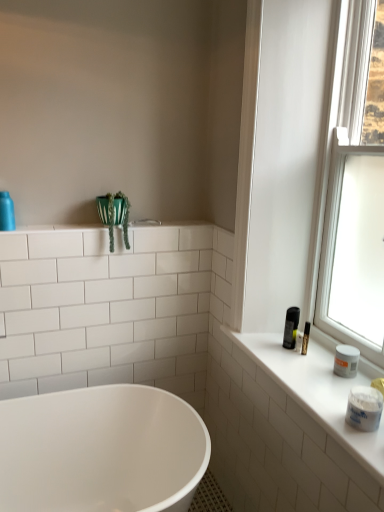
In order to face matte blue bottle at upper left, which appears as the 1th toiletry when viewed from the back, should I rotate leftwards or rightwards?

To face it directly, rotate left by 23.615 degrees.

What is the approximate width of matte blue bottle at upper left, which is counted as the second toiletry, starting from the right?

matte blue bottle at upper left, which is counted as the second toiletry, starting from the right, is 2.74 inches wide.

What is the approximate height of white glossy shelf at upper left?

white glossy shelf at upper left is 0.88 inches in height.

The height and width of the screenshot is (512, 384). Describe the element at coordinates (59, 227) in the screenshot. I see `white glossy shelf at upper left` at that location.

What are the coordinates of `transparent glass window at upper right` in the screenshot? It's located at 342,162.

Is white matte jar at right, the 2th toiletry positioned from the left, at the left side of white glossy bathtub at lower center?

No, white matte jar at right, the 2th toiletry positioned from the left, is not to the left of white glossy bathtub at lower center.

Between white matte jar at right, the 2th toiletry positioned from the left, and white glossy bathtub at lower center, which one has larger width?

Wider between the two is white glossy bathtub at lower center.

In terms of size, does white matte jar at right, which ranks as the second toiletry in top-to-bottom order, appear bigger or smaller than white glossy bathtub at lower center?

In the image, white matte jar at right, which ranks as the second toiletry in top-to-bottom order, appears to be smaller than white glossy bathtub at lower center.

Locate an element on the screen. This screenshot has height=512, width=384. the 1st toiletry above the white glossy bathtub at lower center (from the image's perspective) is located at coordinates (364, 408).

Is white glossy shelf at upper left looking in the opposite direction of matte blue bottle at upper left, the first toiletry viewed from the top?

No.

Are white glossy shelf at upper left and matte blue bottle at upper left, the 2th toiletry from the front, making contact?

No, white glossy shelf at upper left is not next to matte blue bottle at upper left, the 2th toiletry from the front.

Consider the image. Is white glossy shelf at upper left located outside matte blue bottle at upper left, which appears as the 1th toiletry when viewed from the back?

Yes, white glossy shelf at upper left is not within matte blue bottle at upper left, which appears as the 1th toiletry when viewed from the back.

Can you tell me how much white glossy shelf at upper left and matte blue bottle at upper left, marked as the second toiletry in a bottom-to-top arrangement, differ in facing direction?

The angular difference between white glossy shelf at upper left and matte blue bottle at upper left, marked as the second toiletry in a bottom-to-top arrangement, is 0.26 degrees.

Considering the sizes of objects white matte jar at right, the 2th toiletry positioned from the left, and white matte counter top at right in the image provided, who is taller, white matte jar at right, the 2th toiletry positioned from the left, or white matte counter top at right?

white matte jar at right, the 2th toiletry positioned from the left.

From a real-world perspective, does white matte jar at right, which appears as the 1th toiletry when viewed from the front, sit lower than white matte counter top at right?

Incorrect, from a real-world perspective, white matte jar at right, which appears as the 1th toiletry when viewed from the front, is higher than white matte counter top at right.

Looking at this image, is white matte jar at right, which appears as the 1th toiletry when viewed from the front, bigger than white matte counter top at right?

No.

From a real-world perspective, which is physically below, transparent glass window at upper right or matte blue bottle at upper left, which is counted as the second toiletry, starting from the right?

matte blue bottle at upper left, which is counted as the second toiletry, starting from the right, from a real-world perspective.

Is transparent glass window at upper right looking in the opposite direction of matte blue bottle at upper left, which is the 1th toiletry from left to right?

No, matte blue bottle at upper left, which is the 1th toiletry from left to right, is not at the back of transparent glass window at upper right.

Is transparent glass window at upper right in front of or behind matte blue bottle at upper left, which appears as the 1th toiletry when viewed from the back, in the image?

Visually, transparent glass window at upper right is located in front of matte blue bottle at upper left, which appears as the 1th toiletry when viewed from the back.

Can you confirm if transparent glass window at upper right is wider than matte blue bottle at upper left, which is counted as the second toiletry, starting from the right?

Yes.

Measure the distance between transparent glass window at upper right and white glossy bathtub at lower center.

transparent glass window at upper right is 39.06 inches from white glossy bathtub at lower center.

From the picture: Is transparent glass window at upper right looking in the opposite direction of white glossy bathtub at lower center?

transparent glass window at upper right does not have its back to white glossy bathtub at lower center.

Can you confirm if transparent glass window at upper right is smaller than white glossy bathtub at lower center?

Yes.

Can you tell me how much transparent glass window at upper right and white glossy bathtub at lower center differ in facing direction?

89.3 degrees separate the facing orientations of transparent glass window at upper right and white glossy bathtub at lower center.

How much distance is there between white matte counter top at right and white matte jar at right, which appears as the 1th toiletry when viewed from the front?

7.64 inches.

Between point (276, 382) and point (365, 391), which one is positioned in front?

Point (365, 391)

Does white matte counter top at right touch white matte jar at right, which is counted as the 2th toiletry, starting from the back?

No, white matte counter top at right is not next to white matte jar at right, which is counted as the 2th toiletry, starting from the back.

In the image, is white matte counter top at right on the left side or the right side of white matte jar at right, which is counted as the 2th toiletry, starting from the back?

Clearly, white matte counter top at right is on the left of white matte jar at right, which is counted as the 2th toiletry, starting from the back, in the image.

Is matte blue bottle at upper left, marked as the second toiletry in a bottom-to-top arrangement, thinner than green fabric plant at upper left?

Yes.

Considering the points (5, 193) and (127, 246), which point is behind, point (5, 193) or point (127, 246)?

The point (127, 246) is behind.

Who is taller, matte blue bottle at upper left, the 2th toiletry from the front, or green fabric plant at upper left?

With more height is green fabric plant at upper left.

Identify the location of plant that appears below the matte blue bottle at upper left, which is counted as the second toiletry, starting from the right (from the image's perspective). The width and height of the screenshot is (384, 512). (114, 214).

This screenshot has width=384, height=512. Find the location of `bathtub on the left of white matte jar at right, the 2th toiletry positioned from the left`. bathtub on the left of white matte jar at right, the 2th toiletry positioned from the left is located at coordinates (101, 450).

At what (x,y) coordinates should I click in order to perform the action: click on the 1st toiletry in front when counting from the white glossy shelf at upper left. Please return your answer as a coordinate pair (x, y). Looking at the image, I should click on (6, 212).

From the image, which object appears to be nearer to matte blue bottle at upper left, which is counted as the second toiletry, starting from the right, green fabric plant at upper left or white matte counter top at right?

green fabric plant at upper left is closer to matte blue bottle at upper left, which is counted as the second toiletry, starting from the right.

Based on their spatial positions, is white matte jar at right, which is the first toiletry from bottom to top, or transparent glass window at upper right further from white matte counter top at right?

The object further to white matte counter top at right is transparent glass window at upper right.

Based on their spatial positions, is white glossy bathtub at lower center or transparent glass window at upper right closer to white matte jar at right, which is the first toiletry from bottom to top?

transparent glass window at upper right is closer to white matte jar at right, which is the first toiletry from bottom to top.

Looking at the image, which one is located further to white glossy bathtub at lower center, white matte jar at right, acting as the first toiletry starting from the right, or white glossy shelf at upper left?

white matte jar at right, acting as the first toiletry starting from the right, is further to white glossy bathtub at lower center.

In the scene shown: Which object lies further to the anchor point transparent glass window at upper right, white matte counter top at right or white glossy bathtub at lower center?

white glossy bathtub at lower center is positioned further to the anchor transparent glass window at upper right.

From the image, which object appears to be farther from white glossy shelf at upper left, white matte counter top at right or white glossy bathtub at lower center?

white glossy bathtub at lower center is further to white glossy shelf at upper left.

From the image, which object appears to be farther from white matte counter top at right, white matte jar at right, which is the first toiletry from bottom to top, or green fabric plant at upper left?

green fabric plant at upper left.

From the picture: From the image, which object appears to be nearer to white matte counter top at right, transparent glass window at upper right or green fabric plant at upper left?

The object closer to white matte counter top at right is transparent glass window at upper right.

What are the coordinates of `counter top situated between white glossy shelf at upper left and transparent glass window at upper right from left to right` in the screenshot? It's located at (316, 392).

You are a GUI agent. You are given a task and a screenshot of the screen. Output one action in this format:
    pyautogui.click(x=<x>, y=<y>)
    Task: Click on the plant situated between matte blue bottle at upper left, which is counted as the second toiletry, starting from the right, and white matte counter top at right from left to right
    The height and width of the screenshot is (512, 384).
    Given the screenshot: What is the action you would take?
    pyautogui.click(x=114, y=214)

The width and height of the screenshot is (384, 512). In order to click on toiletry between white glossy shelf at upper left and transparent glass window at upper right from left to right in this screenshot , I will do `click(364, 408)`.

Find the location of a particular element. counter top located between white glossy shelf at upper left and white matte jar at right, which is counted as the 2th toiletry, starting from the back, in the left-right direction is located at coordinates (316, 392).